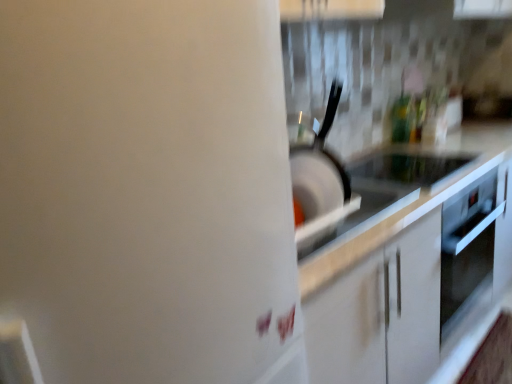
Question: From a real-world perspective, is black matte frying pan at center below white glossy countertop at center?

Choices:
 (A) no
 (B) yes

Answer: (A)

Question: Is black matte frying pan at center located outside white glossy countertop at center?

Choices:
 (A) yes
 (B) no

Answer: (A)

Question: Is black matte frying pan at center at the right side of white glossy countertop at center?

Choices:
 (A) no
 (B) yes

Answer: (A)

Question: Is black matte frying pan at center to the left of white glossy countertop at center from the viewer's perspective?

Choices:
 (A) yes
 (B) no

Answer: (A)

Question: Does black matte frying pan at center turn towards white glossy countertop at center?

Choices:
 (A) yes
 (B) no

Answer: (B)

Question: Does black matte frying pan at center have a larger size compared to white glossy countertop at center?

Choices:
 (A) no
 (B) yes

Answer: (A)

Question: Is white glossy water heater at upper right not within white glossy countertop at center?

Choices:
 (A) yes
 (B) no

Answer: (A)

Question: From the image's perspective, is white glossy water heater at upper right above white glossy countertop at center?

Choices:
 (A) no
 (B) yes

Answer: (B)

Question: Is the position of white glossy water heater at upper right less distant than that of white glossy countertop at center?

Choices:
 (A) yes
 (B) no

Answer: (A)

Question: Does white glossy water heater at upper right have a lesser width compared to white glossy countertop at center?

Choices:
 (A) no
 (B) yes

Answer: (A)

Question: Can you confirm if white glossy water heater at upper right is wider than white glossy countertop at center?

Choices:
 (A) no
 (B) yes

Answer: (B)

Question: Could you tell me if white glossy water heater at upper right is turned towards white glossy countertop at center?

Choices:
 (A) yes
 (B) no

Answer: (B)

Question: Considering the relative sizes of white glossy countertop at center and black glass cooktop at center in the image provided, is white glossy countertop at center wider than black glass cooktop at center?

Choices:
 (A) yes
 (B) no

Answer: (A)